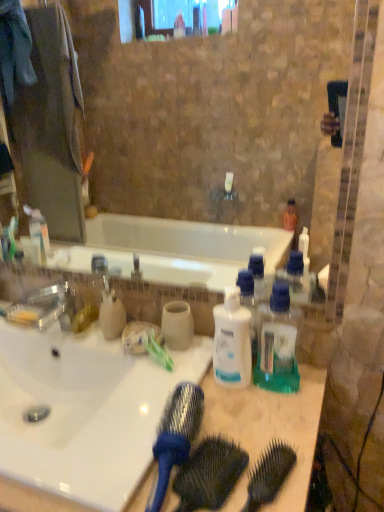
Question: Considering the relative positions of green plastic toothbrush at center and blue plastic brush at center, which appears as the 1th brush when viewed from the left, in the image provided, is green plastic toothbrush at center in front of blue plastic brush at center, which appears as the 1th brush when viewed from the left,?

Choices:
 (A) yes
 (B) no

Answer: (B)

Question: Is green plastic toothbrush at center placed right next to blue plastic brush at center, which is the 2th brush in right-to-left order?

Choices:
 (A) yes
 (B) no

Answer: (B)

Question: From a real-world perspective, does green plastic toothbrush at center stand above blue plastic brush at center, which appears as the 1th brush when viewed from the left?

Choices:
 (A) yes
 (B) no

Answer: (B)

Question: Is green plastic toothbrush at center positioned beyond the bounds of blue plastic brush at center, which is the 2th brush in right-to-left order?

Choices:
 (A) yes
 (B) no

Answer: (A)

Question: Can you confirm if green plastic toothbrush at center is shorter than blue plastic brush at center, which is the 2th brush in right-to-left order?

Choices:
 (A) yes
 (B) no

Answer: (A)

Question: Can you confirm if green plastic toothbrush at center is smaller than blue plastic brush at center, which appears as the 1th brush when viewed from the left?

Choices:
 (A) no
 (B) yes

Answer: (B)

Question: Is translucent green plastic at center, the 1th bottle positioned from the right, to the left of blue plastic comb at center from the viewer's perspective?

Choices:
 (A) no
 (B) yes

Answer: (A)

Question: Does translucent green plastic at center, the 1th bottle positioned from the right, have a greater height compared to blue plastic comb at center?

Choices:
 (A) yes
 (B) no

Answer: (A)

Question: Considering the relative sizes of translucent green plastic at center, which appears as the 2th bottle when viewed from the left, and blue plastic comb at center in the image provided, is translucent green plastic at center, which appears as the 2th bottle when viewed from the left, shorter than blue plastic comb at center?

Choices:
 (A) no
 (B) yes

Answer: (A)

Question: Is the surface of translucent green plastic at center, which appears as the 2th bottle when viewed from the left, in direct contact with blue plastic comb at center?

Choices:
 (A) yes
 (B) no

Answer: (B)

Question: Does translucent green plastic at center, which appears as the 2th bottle when viewed from the left, lie behind blue plastic comb at center?

Choices:
 (A) yes
 (B) no

Answer: (A)

Question: Is translucent green plastic at center, which appears as the 2th bottle when viewed from the left, bigger than blue plastic comb at center?

Choices:
 (A) no
 (B) yes

Answer: (B)

Question: Does translucent green plastic at center, the 1th bottle positioned from the right, have a greater height compared to white plastic bottle at center, which is the 1th bottle in left-to-right order?

Choices:
 (A) yes
 (B) no

Answer: (A)